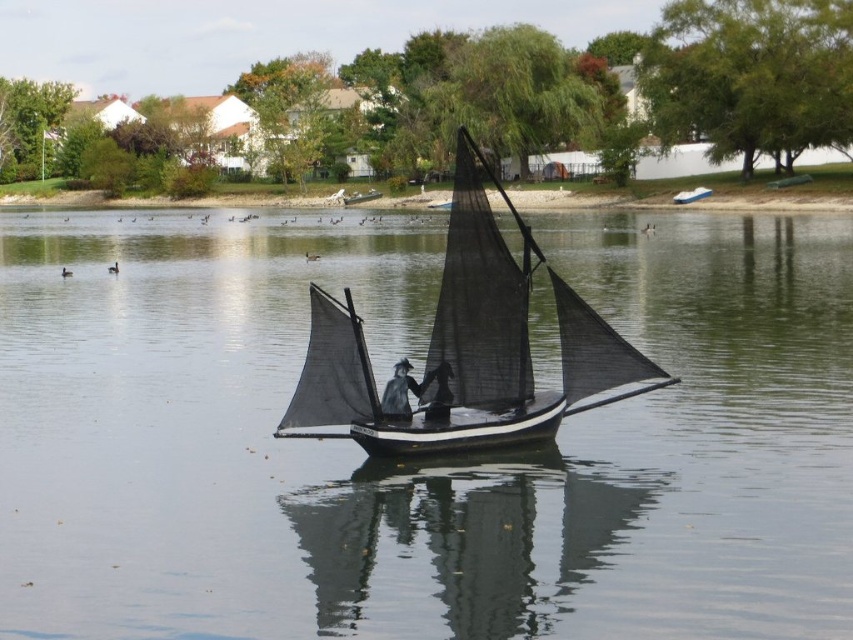
Who is positioned more to the left, dark gray fabric hat at center or metallic blue sailboat at center?

Positioned to the left is dark gray fabric hat at center.

Which is behind, point (395, 419) or point (704, 195)?

The point (704, 195) is more distant.

Find the location of `dark gray fabric hat at center`. dark gray fabric hat at center is located at coordinates (399, 392).

What do you see at coordinates (416, 464) in the screenshot? Image resolution: width=853 pixels, height=640 pixels. I see `transparent water at center` at bounding box center [416, 464].

Who is positioned more to the right, transparent water at center or metallic blue sailboat at center?

From the viewer's perspective, metallic blue sailboat at center appears more on the right side.

Does point (734, 234) come farther from viewer compared to point (679, 198)?

That is False.

The height and width of the screenshot is (640, 853). I want to click on transparent water at center, so click(416, 464).

Who is positioned more to the right, transparent water at center or black mesh sailboat at center?

black mesh sailboat at center is more to the right.

The image size is (853, 640). Describe the element at coordinates (416, 464) in the screenshot. I see `transparent water at center` at that location.

This screenshot has width=853, height=640. I want to click on transparent water at center, so click(416, 464).